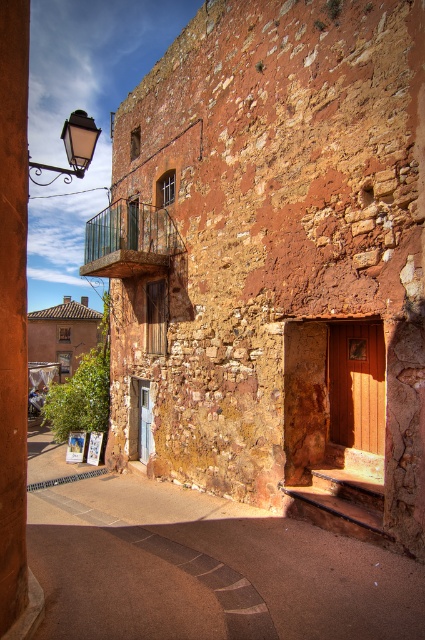
Is brown stone pillar at left smaller than green glass balcony at upper left?

Correct, brown stone pillar at left occupies less space than green glass balcony at upper left.

Which is in front, point (6, 534) or point (116, 237)?

Point (6, 534) is more forward.

What do you see at coordinates (14, 326) in the screenshot? I see `brown stone pillar at left` at bounding box center [14, 326].

Locate an element on the screen. This screenshot has height=640, width=425. brown stone pillar at left is located at coordinates (14, 326).

Is point (396, 564) positioned behind point (93, 269)?

No, it is not.

Is point (263, 612) positioned after point (119, 241)?

No, (263, 612) is closer to viewer.

The image size is (425, 640). I want to click on brown concrete alley at center, so click(x=206, y=570).

From the picture: Does brown concrete alley at center come behind brown stone pillar at left?

No.

How distant is brown concrete alley at center from brown stone pillar at left?

brown concrete alley at center is 3.54 meters away from brown stone pillar at left.

This screenshot has height=640, width=425. What do you see at coordinates (206, 570) in the screenshot? I see `brown concrete alley at center` at bounding box center [206, 570].

Identify the location of brown concrete alley at center. The image size is (425, 640). (206, 570).